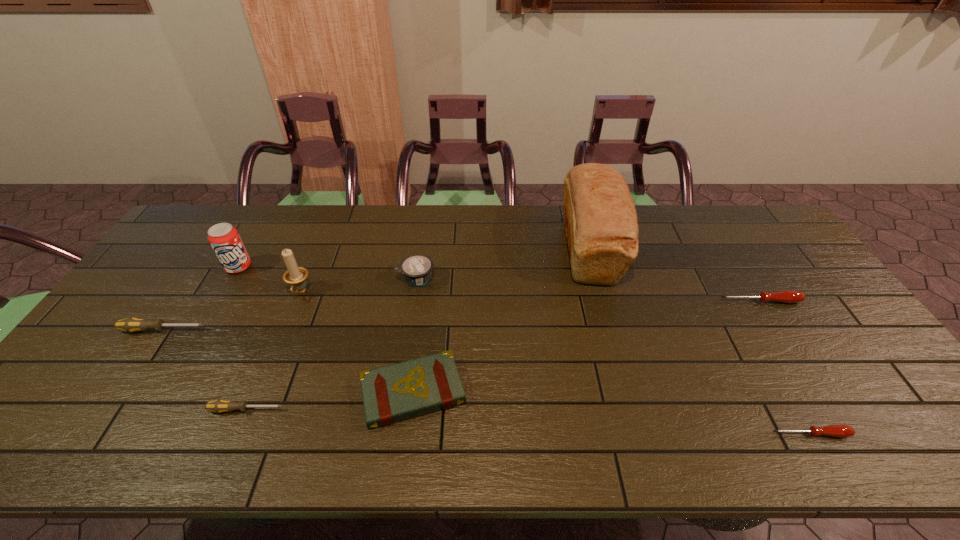
The image size is (960, 540). Find the location of `free region at the right edge of the desktop`. free region at the right edge of the desktop is located at coordinates click(x=785, y=318).

At what (x,y) coordinates should I click in order to perform the action: click on vacant space at the far left corner of the desktop. Please return your answer as a coordinate pair (x, y). This screenshot has height=540, width=960. Looking at the image, I should click on (209, 225).

At what (x,y) coordinates should I click in order to perform the action: click on vacant space at the far right corner of the desktop. Please return your answer as a coordinate pair (x, y). Looking at the image, I should click on (724, 211).

You are a GUI agent. You are given a task and a screenshot of the screen. Output one action in this format:
    pyautogui.click(x=<x>, y=<y>)
    Task: Click on the free space at the near right corner
    This screenshot has width=960, height=540.
    Given the screenshot: What is the action you would take?
    pyautogui.click(x=882, y=455)

Locate an element on the screen. Image resolution: width=960 pixels, height=540 pixels. unoccupied area between the shortest screwdriver and the leftmost screwdriver is located at coordinates (487, 382).

You are a GUI agent. You are given a task and a screenshot of the screen. Output one action in this format:
    pyautogui.click(x=<x>, y=<y>)
    Task: Click on the free area in between the smaller gray screwdriver and the brown bread
    
    Given the screenshot: What is the action you would take?
    pyautogui.click(x=418, y=329)

Image resolution: width=960 pixels, height=540 pixels. Identify the location of unoccupied position between the candle_holder and the farther red screwdriver. (530, 297).

Where is `vacant area that lies between the soda can and the fourth tallest object`? vacant area that lies between the soda can and the fourth tallest object is located at coordinates (327, 273).

The width and height of the screenshot is (960, 540). Identify the location of vacant space that's between the soda can and the second screwdriver from left to right. (243, 339).

Find the location of a particular element. This screenshot has width=960, height=540. empty location between the candle_holder and the second nearest screwdriver is located at coordinates (274, 351).